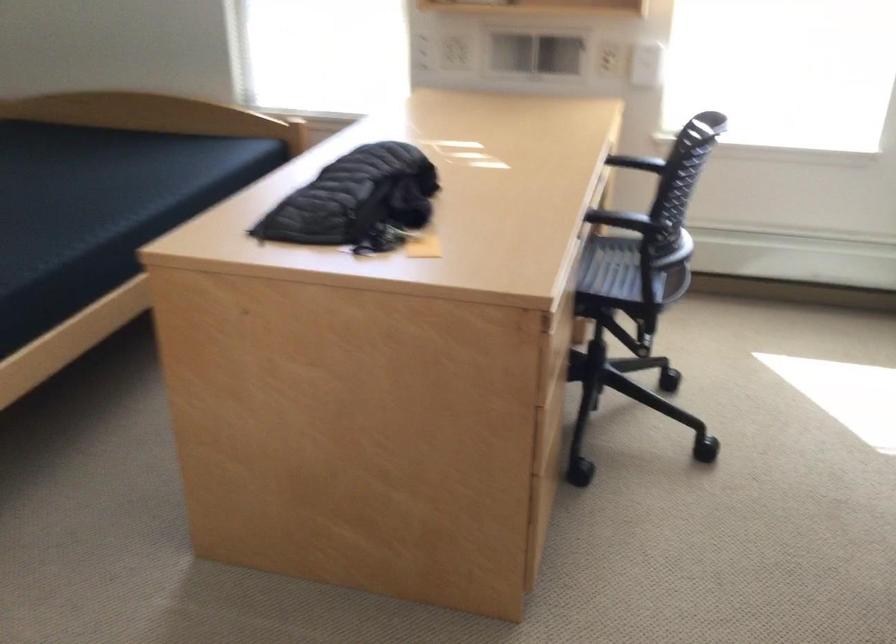
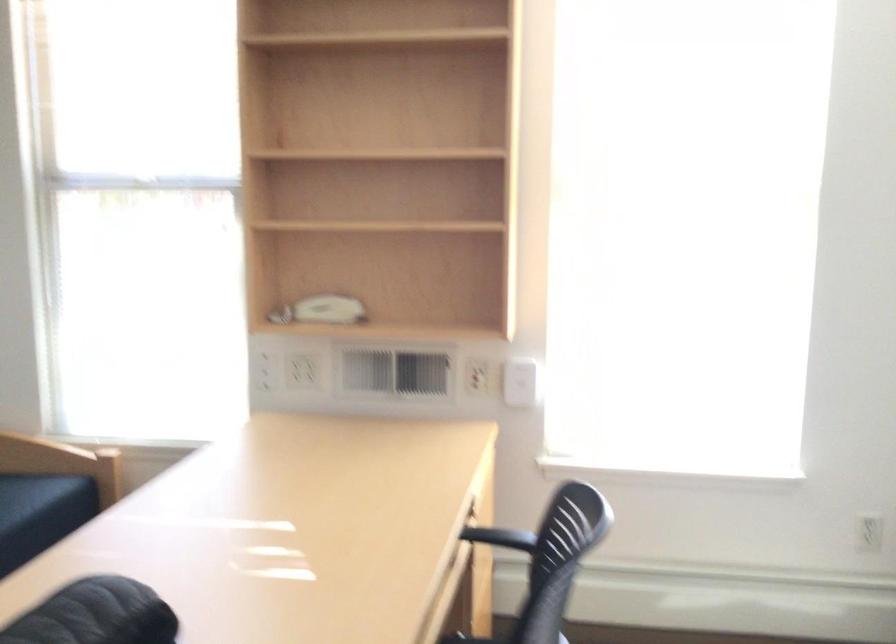
Consider the image. In a continuous first-person perspective shot, in which direction is the camera moving?

The movement direction of the cameraman is right, forward.